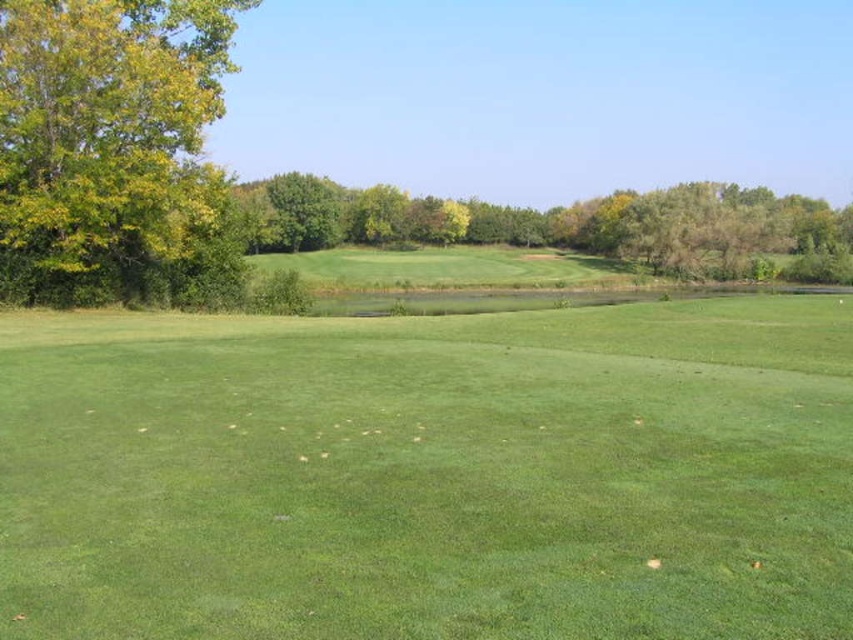
From the picture: You are a landscape architect designing a new park and want to place a bench between the green leafy tree at left and the green leafy trees at center. Which tree group should the bench be closer to if you want it near the thinner trees?

The bench should be placed closer to the green leafy tree at left because it is thinner than the green leafy trees at center.

You are standing at the edge of the forest and want to walk to the water. You see the green smooth grass at center and the green leafy tree at center. Which direction should you walk to reach the water while avoiding the tree?

You should walk to the right of the green leafy tree at center, as the green smooth grass at center is located to the right of the tree, leading towards the water.